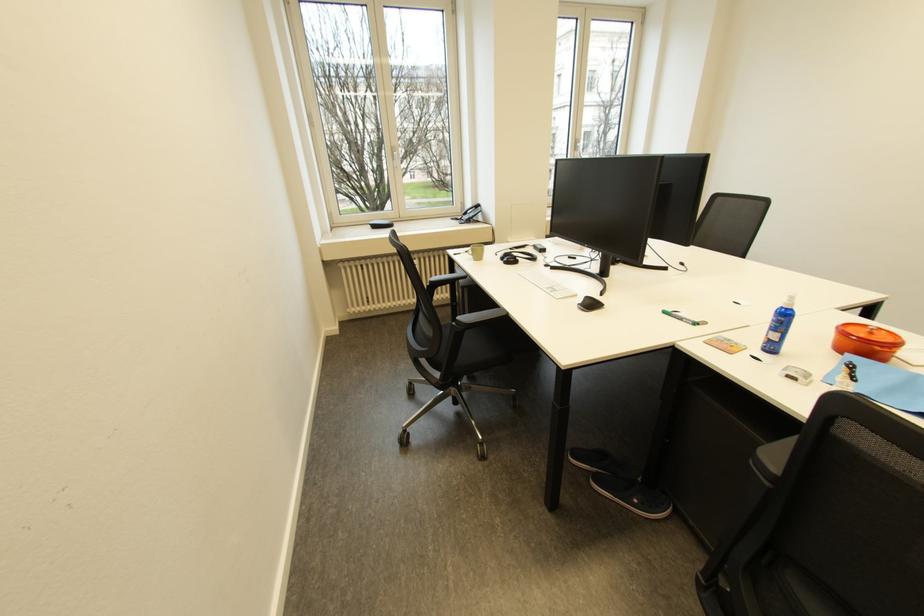
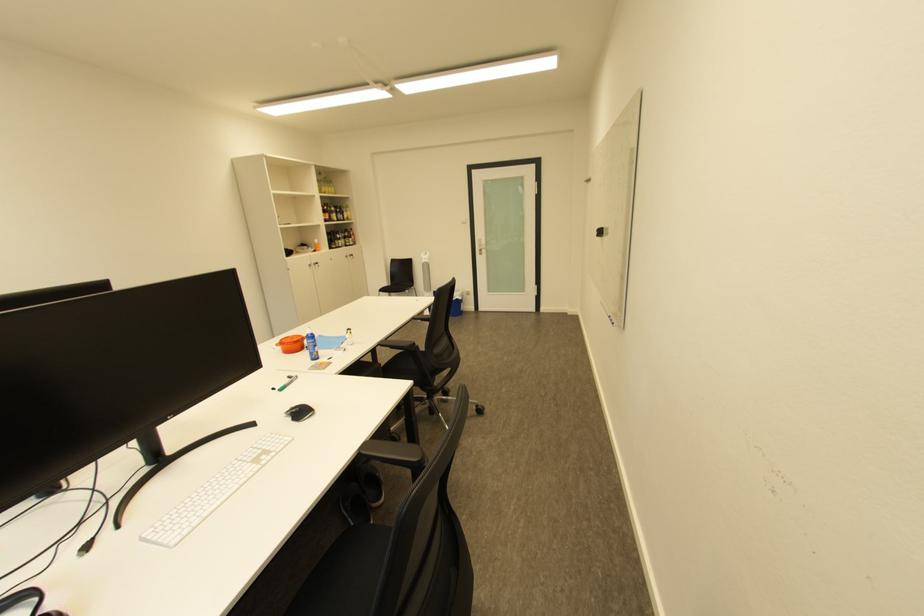
Where in the second image is the point corresponding to point 890,330 from the first image?

(292, 341)